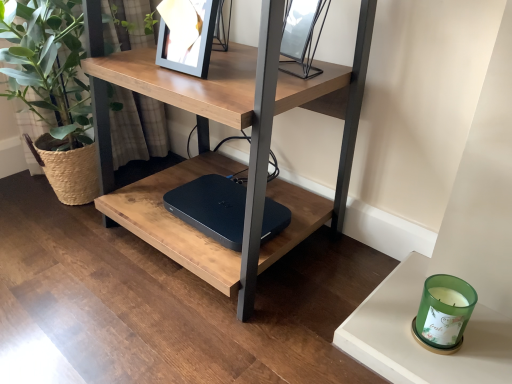
Locate an element on the screen. Image resolution: width=512 pixels, height=384 pixels. black matte laptop at center is located at coordinates (211, 208).

The image size is (512, 384). What do you see at coordinates (443, 313) in the screenshot? I see `green glass candle at lower right` at bounding box center [443, 313].

This screenshot has width=512, height=384. Find the location of `green woven basket at left`. green woven basket at left is located at coordinates (52, 91).

This screenshot has height=384, width=512. What do you see at coordinates (301, 35) in the screenshot? I see `metallic silver picture frame at upper center` at bounding box center [301, 35].

Identify the location of metallic silver picture frame at upper center. (301, 35).

Identify the location of black matte laptop at center. The image size is (512, 384). (211, 208).

Does green glass candle at lower right have a lesser height compared to green woven basket at left?

Correct, green glass candle at lower right is not as tall as green woven basket at left.

This screenshot has width=512, height=384. I want to click on candle holder lying on the right of green woven basket at left, so click(x=443, y=313).

From a real-world perspective, who is located lower, green glass candle at lower right or green woven basket at left?

green glass candle at lower right.

Is green glass candle at lower right turned away from green woven basket at left?

green glass candle at lower right is not turned away from green woven basket at left.

In the image, is green woven basket at left positioned in front of or behind green glass candle at lower right?

In the image, green woven basket at left appears behind green glass candle at lower right.

Considering the relative sizes of green woven basket at left and green glass candle at lower right in the image provided, is green woven basket at left wider than green glass candle at lower right?

Yes, green woven basket at left is wider than green glass candle at lower right.

How far apart are green woven basket at left and green glass candle at lower right?

They are 1.13 meters apart.

From their relative heights in the image, would you say green woven basket at left is taller or shorter than green glass candle at lower right?

Considering their sizes, green woven basket at left has more height than green glass candle at lower right.

Can you see metallic silver picture frame at upper center touching green glass candle at lower right?

There is a gap between metallic silver picture frame at upper center and green glass candle at lower right.

Is metallic silver picture frame at upper center shorter than green glass candle at lower right?

In fact, metallic silver picture frame at upper center may be taller than green glass candle at lower right.

Is metallic silver picture frame at upper center oriented towards green glass candle at lower right?

No, metallic silver picture frame at upper center is not turned towards green glass candle at lower right.

How different are the orientations of green woven basket at left and metallic silver picture frame at upper center in degrees?

green woven basket at left and metallic silver picture frame at upper center are facing 15.2 degrees away from each other.

Which is in front, green woven basket at left or metallic silver picture frame at upper center?

metallic silver picture frame at upper center is more forward.

Is green woven basket at left to the right of metallic silver picture frame at upper center from the viewer's perspective?

No, green woven basket at left is not to the right of metallic silver picture frame at upper center.

Considering the points (58, 67) and (283, 50), which point is in front, point (58, 67) or point (283, 50)?

The point (283, 50) is closer.

Considering the relative sizes of green glass candle at lower right and black matte laptop at center in the image provided, is green glass candle at lower right thinner than black matte laptop at center?

Yes, green glass candle at lower right is thinner than black matte laptop at center.

What's the angular difference between green glass candle at lower right and black matte laptop at center's facing directions?

The angular difference between green glass candle at lower right and black matte laptop at center is 3.44 degrees.

Considering the relative sizes of green glass candle at lower right and black matte laptop at center in the image provided, is green glass candle at lower right shorter than black matte laptop at center?

Incorrect, the height of green glass candle at lower right does not fall short of that of black matte laptop at center.

Looking at this image, is green glass candle at lower right to the left of black matte laptop at center from the viewer's perspective?

No.

From the picture: Is black matte laptop at center not inside metallic silver picture frame at upper center?

black matte laptop at center lies outside metallic silver picture frame at upper center's area.

Does black matte laptop at center appear on the left side of metallic silver picture frame at upper center?

Yes.

I want to click on picture frame to the right of black matte laptop at center, so click(301, 35).

Which object is thinner, black matte laptop at center or green woven basket at left?

Thinner between the two is black matte laptop at center.

Would you say black matte laptop at center is inside or outside green woven basket at left?

black matte laptop at center is not enclosed by green woven basket at left.

Looking at the image, does black matte laptop at center seem bigger or smaller compared to green woven basket at left?

Considering their sizes, black matte laptop at center takes up less space than green woven basket at left.

Is black matte laptop at center oriented towards green woven basket at left?

No, black matte laptop at center is not oriented towards green woven basket at left.

Locate an element on the screen. The width and height of the screenshot is (512, 384). houseplant that is above the green glass candle at lower right (from the image's perspective) is located at coordinates (52, 91).

Locate an element on the screen. The image size is (512, 384). houseplant behind the green glass candle at lower right is located at coordinates click(x=52, y=91).

Looking at this image, considering their positions, is green glass candle at lower right positioned closer to green woven basket at left than metallic silver picture frame at upper center?

Based on the image, metallic silver picture frame at upper center appears to be nearer to green woven basket at left.

Looking at the image, which one is located closer to green glass candle at lower right, matte wood table at center or green woven basket at left?

Among the two, matte wood table at center is located nearer to green glass candle at lower right.

From the image, which object appears to be nearer to metallic silver picture frame at upper center, green woven basket at left or matte wood table at center?

matte wood table at center lies closer to metallic silver picture frame at upper center than the other object.

Looking at the image, which one is located further to metallic silver picture frame at upper center, matte wood table at center or green glass candle at lower right?

The object further to metallic silver picture frame at upper center is green glass candle at lower right.

Based on their spatial positions, is green glass candle at lower right or black matte laptop at center closer to green woven basket at left?

Based on the image, black matte laptop at center appears to be nearer to green woven basket at left.

Estimate the real-world distances between objects in this image. Which object is closer to black matte laptop at center, green glass candle at lower right or matte wood table at center?

matte wood table at center.

Looking at the image, which one is located closer to green glass candle at lower right, metallic silver picture frame at upper center or green woven basket at left?

Based on the image, metallic silver picture frame at upper center appears to be nearer to green glass candle at lower right.

Looking at the image, which one is located closer to green glass candle at lower right, matte wood table at center or black matte laptop at center?

black matte laptop at center.

This screenshot has height=384, width=512. In order to click on laptop between green woven basket at left and green glass candle at lower right in the horizontal direction in this screenshot , I will do `click(211, 208)`.

In order to click on laptop between metallic silver picture frame at upper center and green glass candle at lower right in the vertical direction in this screenshot , I will do `click(211, 208)`.

Locate an element on the screen. table between metallic silver picture frame at upper center and black matte laptop at center from top to bottom is located at coordinates (217, 155).

Identify the location of table that lies between metallic silver picture frame at upper center and green glass candle at lower right from top to bottom. Image resolution: width=512 pixels, height=384 pixels. (217, 155).